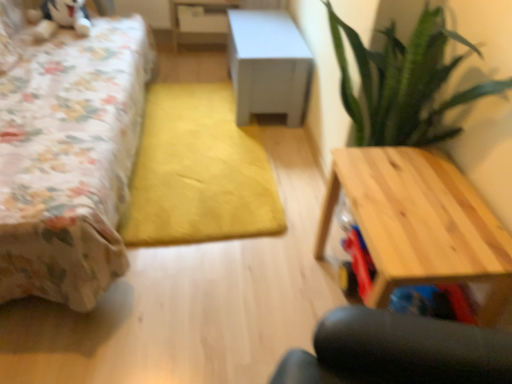
Question: Can you confirm if white matte cabinet at center, positioned as the 2th table in back-to-front order, is taller than light wood table at right, placed as the third table when sorted from back to front?

Choices:
 (A) no
 (B) yes

Answer: (A)

Question: Considering the relative sizes of white matte cabinet at center, positioned as the 2th table in back-to-front order, and light wood table at right, placed as the third table when sorted from back to front, in the image provided, is white matte cabinet at center, positioned as the 2th table in back-to-front order, shorter than light wood table at right, placed as the third table when sorted from back to front,?

Choices:
 (A) no
 (B) yes

Answer: (B)

Question: Can you confirm if white matte cabinet at center, which is the second table from top to bottom, is thinner than light wood table at right, the 1th table in the bottom-to-top sequence?

Choices:
 (A) no
 (B) yes

Answer: (A)

Question: Are white matte cabinet at center, which is the second table from top to bottom, and light wood table at right, placed as the third table when sorted from back to front, located far from each other?

Choices:
 (A) no
 (B) yes

Answer: (B)

Question: Is white matte cabinet at center, positioned as the 2th table in back-to-front order, bigger than light wood table at right, which is counted as the third table, starting from the top?

Choices:
 (A) yes
 (B) no

Answer: (A)

Question: In the image, is white glossy table at upper center, placed as the third table when sorted from bottom to top, positioned in front of or behind white matte cabinet at center, which ranks as the 2th table in bottom-to-top order?

Choices:
 (A) behind
 (B) front

Answer: (A)

Question: From a real-world perspective, is white glossy table at upper center, the third table in the front-to-back sequence, physically located above or below white matte cabinet at center, which ranks as the 2th table in bottom-to-top order?

Choices:
 (A) above
 (B) below

Answer: (A)

Question: Looking at their shapes, would you say white glossy table at upper center, acting as the 1th table starting from the back, is wider or thinner than white matte cabinet at center, positioned as the 2th table in back-to-front order?

Choices:
 (A) thin
 (B) wide

Answer: (A)

Question: In terms of size, does white glossy table at upper center, the 1th table viewed from the top, appear bigger or smaller than white matte cabinet at center, positioned as the 2th table in back-to-front order?

Choices:
 (A) big
 (B) small

Answer: (B)

Question: Is point (176, 26) positioned closer to the camera than point (416, 201)?

Choices:
 (A) farther
 (B) closer

Answer: (A)

Question: From the image's perspective, is white glossy table at upper center, placed as the third table when sorted from bottom to top, above or below light wood table at right, placed as the third table when sorted from back to front?

Choices:
 (A) below
 (B) above

Answer: (B)

Question: Considering their positions, is white glossy table at upper center, placed as the third table when sorted from bottom to top, located in front of or behind light wood table at right, placed as the third table when sorted from back to front?

Choices:
 (A) front
 (B) behind

Answer: (B)

Question: Is white glossy table at upper center, the 1th table viewed from the top, taller or shorter than light wood table at right, the 1th table in the bottom-to-top sequence?

Choices:
 (A) tall
 (B) short

Answer: (B)

Question: From the image's perspective, is white glossy table at upper center, placed as the third table when sorted from bottom to top, above or below floral fabric bed at left?

Choices:
 (A) below
 (B) above

Answer: (B)

Question: Relative to floral fabric bed at left, is white glossy table at upper center, acting as the 1th table starting from the back, in front or behind?

Choices:
 (A) behind
 (B) front

Answer: (A)